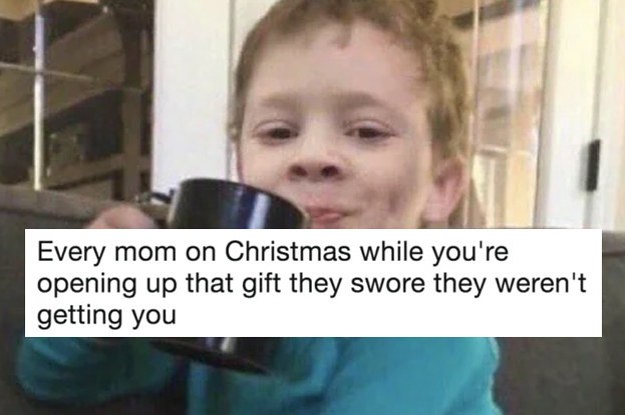
At what (x,y) coordinates should I click in order to perform the action: click on mug. Please return your answer as a coordinate pair (x, y). The height and width of the screenshot is (415, 625). Looking at the image, I should click on (204, 200).